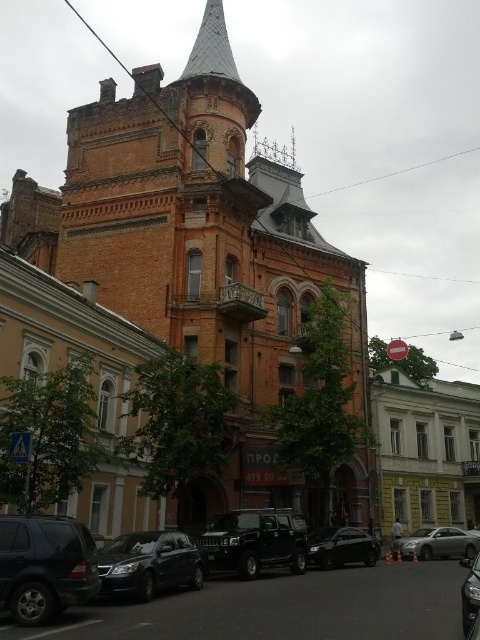
Is black matte suv at center to the right of black glossy car at center from the viewer's perspective?

No, black matte suv at center is not to the right of black glossy car at center.

Can you confirm if black matte suv at center is taller than black glossy car at center?

Yes.

Is point (216, 524) more distant than point (350, 556)?

No, (216, 524) is in front of (350, 556).

The image size is (480, 640). In order to click on black matte suv at center in this screenshot , I will do `click(254, 541)`.

At what (x,y) coordinates should I click in order to perform the action: click on matte black suv at lower left. Please return your answer as a coordinate pair (x, y). The width and height of the screenshot is (480, 640). Looking at the image, I should click on (45, 566).

Identify the location of matte black suv at lower left. (45, 566).

Is black matte suv at center closer to the viewer compared to shiny black sedan at lower left?

No, it is not.

Does black matte suv at center have a smaller size compared to shiny black sedan at lower left?

No.

Image resolution: width=480 pixels, height=640 pixels. I want to click on black matte suv at center, so click(254, 541).